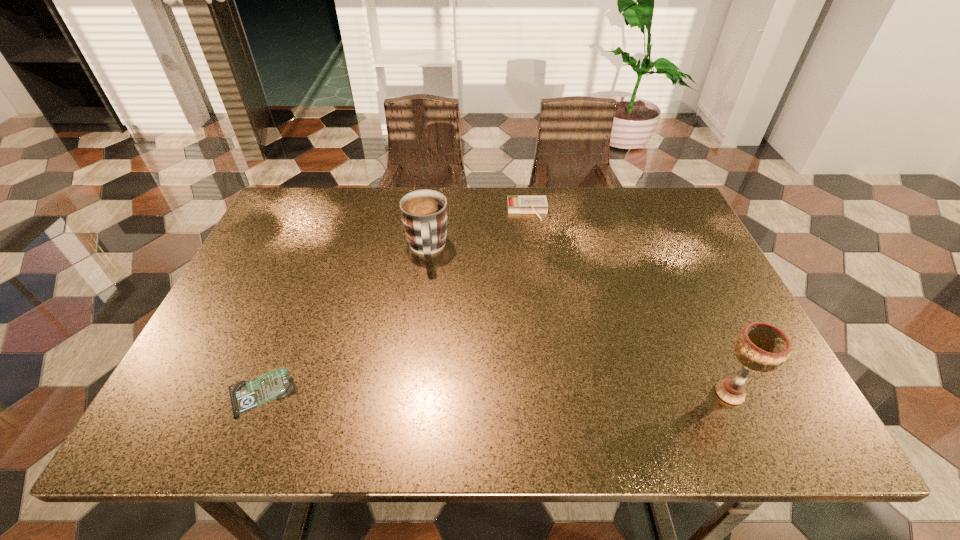
Identify the location of free point located 0.330m on the side of the mug with the handle. This screenshot has width=960, height=540. (432, 379).

Find the location of `free spot located on the side of the mug with the handle`. free spot located on the side of the mug with the handle is located at coordinates (428, 295).

Locate an element on the screen. The image size is (960, 540). vacant space located on the side of the mug with the handle is located at coordinates (430, 337).

Find the location of a particular element. vacant space situated on the striking surface of the farthest object is located at coordinates (538, 284).

The image size is (960, 540). I want to click on vacant region located 0.330m on the striking surface of the farthest object, so point(540,304).

The image size is (960, 540). Find the location of `vacant area located 0.340m on the striking surface of the farthest object`. vacant area located 0.340m on the striking surface of the farthest object is located at coordinates (541, 307).

Where is `mug that is at the far edge`? mug that is at the far edge is located at coordinates (424, 214).

Identify the location of matchbox present at the far edge. The image size is (960, 540). (516, 204).

Locate an element on the screen. identity card that is at the near edge is located at coordinates (245, 395).

Where is `chalice at the near edge`? chalice at the near edge is located at coordinates (761, 347).